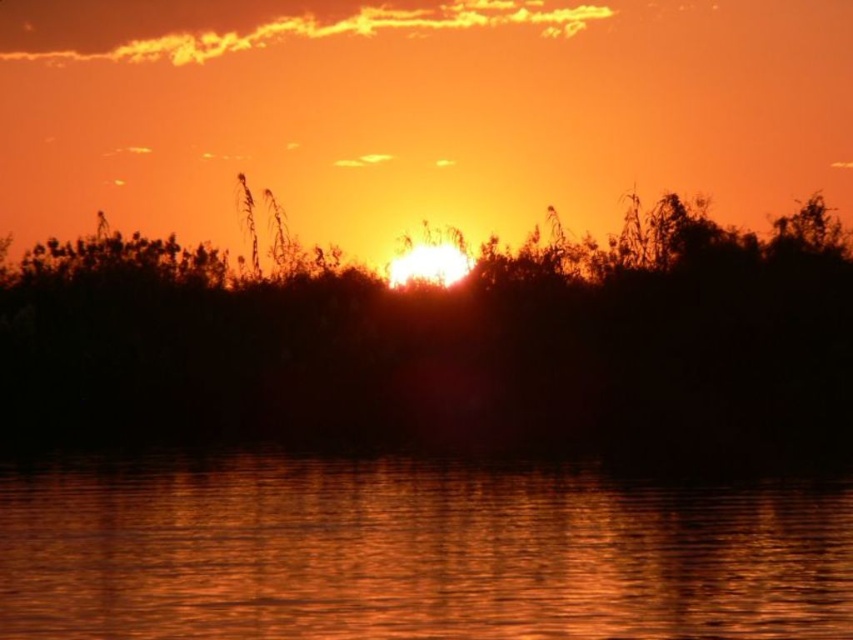
You are an artist trying to paint the sunset scene. You want to ensure the silhouette leafy tree at center and the glistening water at center are proportionally accurate. Which object should you paint larger?

The silhouette leafy tree at center should be painted larger since it has a larger size compared to the glistening water at center according to the description.

You are standing on a dock observing the sunset scene. You notice the silhouette leafy tree at center and the glistening water at center. Which object is closer to you, the observer?

The silhouette leafy tree at center is positioned over glistening water at center, meaning it is closer to you than the water.

You are a photographer standing at the edge of the water. You want to capture both the silhouette leafy tree at center and the glistening water at center in the same frame. Given that your camera has a focal length of 50mm, which is suitable for capturing objects up to 15 meters apart in the same shot, will you need to adjust your position or equipment to include both subjects?

The silhouette leafy tree at center and glistening water at center are 16.77 meters apart, which exceeds the camera lens focal length of 50mm that can capture up to 15 meters. Therefore, you need to move closer to the subjects or use a wider lens to include both in the frame.